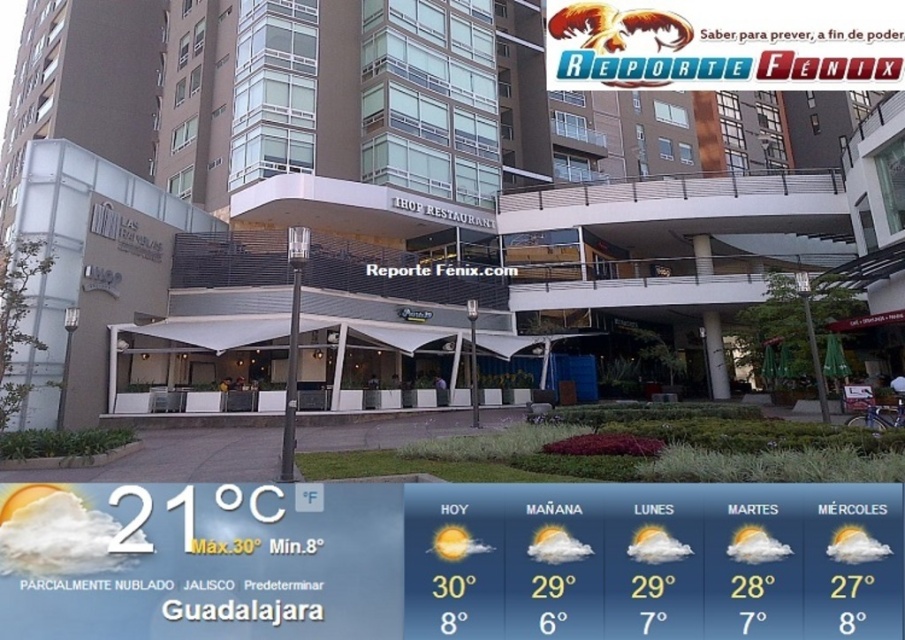
Is white awning at center closer to the viewer compared to white cloud weather forecast at lower left?

No, white awning at center is behind white cloud weather forecast at lower left.

The image size is (905, 640). What do you see at coordinates (370, 188) in the screenshot? I see `white awning at center` at bounding box center [370, 188].

At what (x,y) coordinates should I click in order to perform the action: click on white awning at center. Please return your answer as a coordinate pair (x, y). This screenshot has width=905, height=640. Looking at the image, I should click on (370, 188).